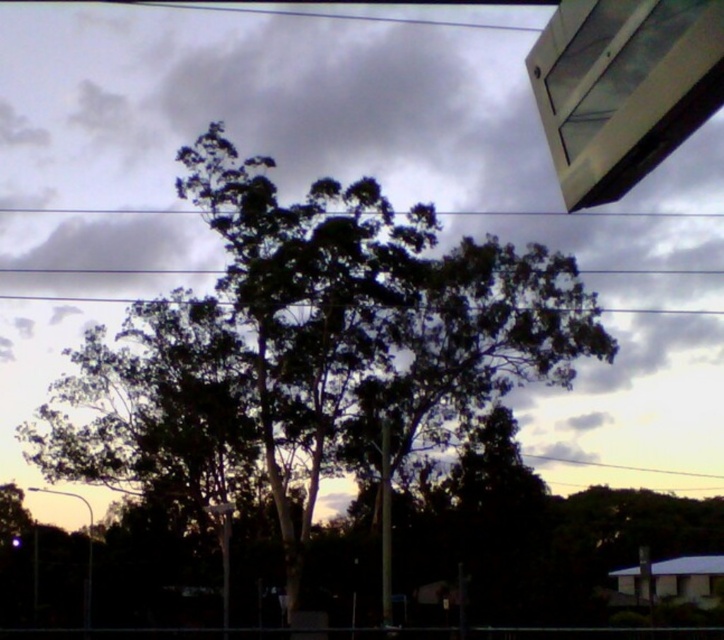
Can you confirm if green leafy tree at center is positioned to the right of white plastic street sign at lower center?

Correct, you'll find green leafy tree at center to the right of white plastic street sign at lower center.

Does point (426, 257) come farther from viewer compared to point (224, 508)?

Yes, point (426, 257) is behind point (224, 508).

Is point (256, 417) farther from viewer compared to point (227, 552)?

Yes, it is.

I want to click on green leafy tree at center, so click(311, 348).

Who is higher up, dark gray cloud at upper center or black wire at upper center?

Positioned higher is black wire at upper center.

Who is more forward, [83,284] or [492,212]?

Positioned in front is point [492,212].

You are a GUI agent. You are given a task and a screenshot of the screen. Output one action in this format:
    pyautogui.click(x=<x>, y=<y>)
    Task: Click on the dark gray cloud at upper center
    Image resolution: width=724 pixels, height=640 pixels.
    Given the screenshot: What is the action you would take?
    pyautogui.click(x=340, y=179)

Does dark gray cloud at upper center have a greater height compared to green leafy tree at center?

Yes, dark gray cloud at upper center is taller than green leafy tree at center.

Does dark gray cloud at upper center have a lesser width compared to green leafy tree at center?

No, dark gray cloud at upper center is not thinner than green leafy tree at center.

Between point (138, 67) and point (203, 182), which one is positioned behind?

Positioned behind is point (138, 67).

The height and width of the screenshot is (640, 724). In order to click on dark gray cloud at upper center in this screenshot , I will do `click(340, 179)`.